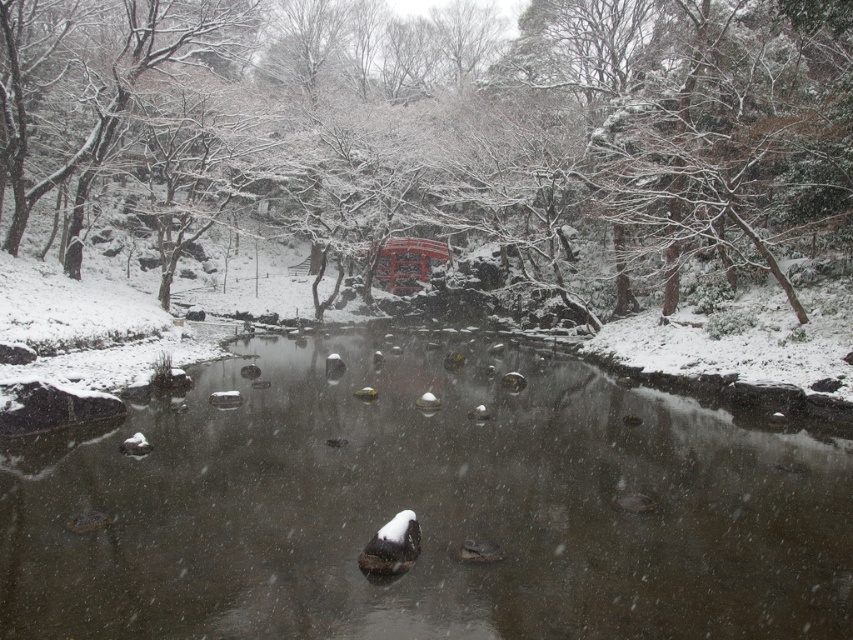
Based on the provided scene description, where is the smooth stone river at center located in the image?

The smooth stone river at center is located at point (426,509) in the image.

You are standing at the edge of the serene winter scene in the Japanese garden. You see a point labeled as point (426, 509). What does this point correspond to in the scene?

The point corresponds to the smooth stone river at center.